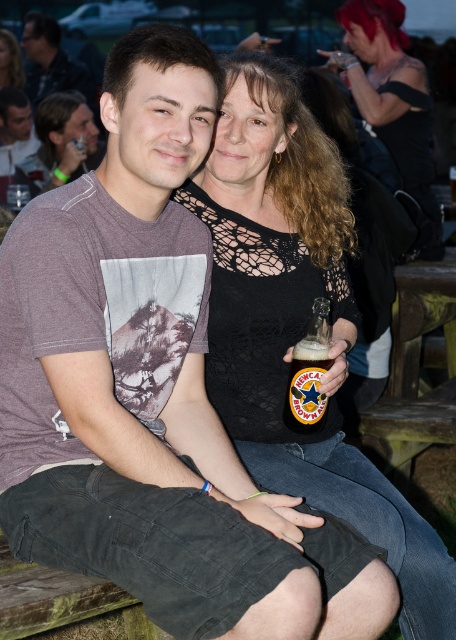
You are a photographer at the event. You want to take a photo of the black lace top at center and the translucent glass bottle at center. Which object should you focus on first if you want to capture both clearly?

The black lace top at center is wider than the translucent glass bottle at center, so you should focus on the black lace top at center first to ensure both are in focus.

You are a photographer at the event and want to capture a closeup shot of both the shiny black hair at upper right and the translucent glass bottle at center. However, your camera has a limited field of view. Can you fit both objects in the frame if the width of the camera frame is equal to the combined width of both objects?

The shiny black hair at upper right is wider than the translucent glass bottle at center. Since the camera frame width is equal to their combined widths, the total width required would be greater than the frame can accommodate. Therefore, both objects cannot fit within the frame simultaneously.